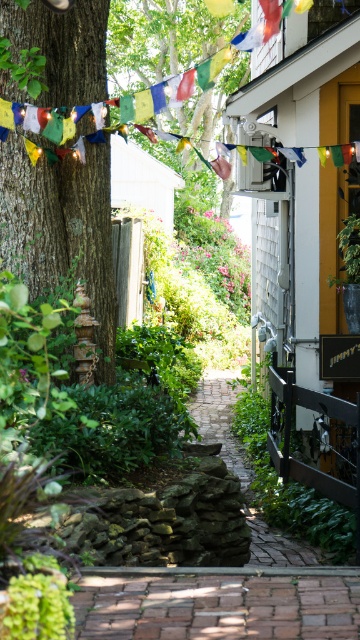
You are standing at the entrance of the garden and see two points marked in the image. Which point is closer to you, point (9, 244) or point (191, 116)?

Point (9, 244) is in front of point (191, 116), so it is closer to you.